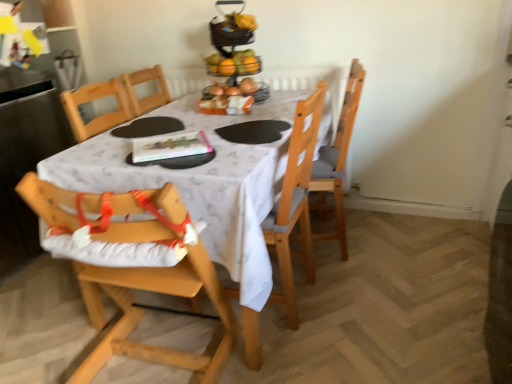
You are a GUI agent. You are given a task and a screenshot of the screen. Output one action in this format:
    pyautogui.click(x=<x>, y=<y>)
    Task: Click on the free space to the right of white fabric table at center
    
    Given the screenshot: What is the action you would take?
    pyautogui.click(x=406, y=283)